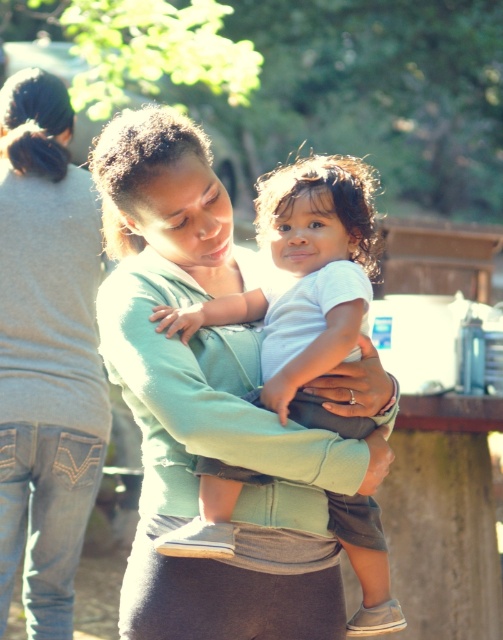
Question: Is matte green sweater at center to the right of white soft cotton baby at center from the viewer's perspective?

Choices:
 (A) yes
 (B) no

Answer: (B)

Question: Among these points, which one is farthest from the camera?

Choices:
 (A) (259, 182)
 (B) (8, 180)

Answer: (A)

Question: From the image, what is the correct spatial relationship of matte green sweater at center in relation to white soft cotton baby at center?

Choices:
 (A) below
 (B) above

Answer: (B)

Question: Among these points, which one is farthest from the camera?

Choices:
 (A) (333, 246)
 (B) (7, 225)

Answer: (B)

Question: Is matte green sweater at center to the right of white soft cotton baby at center from the viewer's perspective?

Choices:
 (A) yes
 (B) no

Answer: (B)